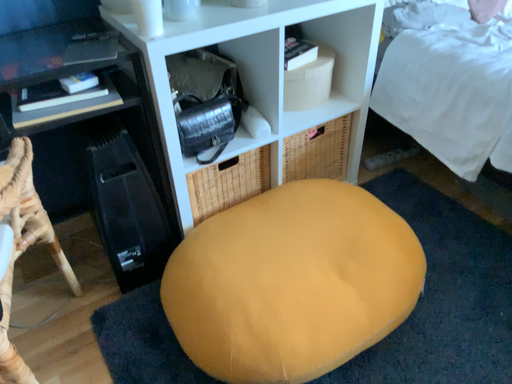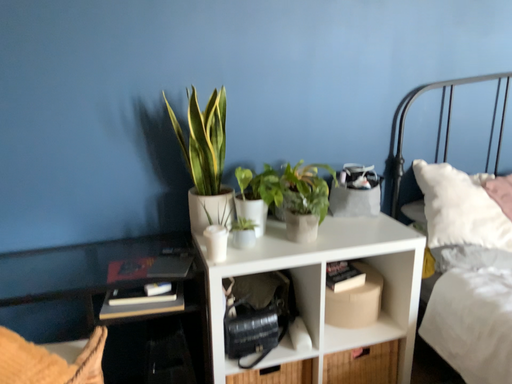
Question: Which way did the camera rotate in the video?

Choices:
 (A) rotated right
 (B) rotated left

Answer: (B)